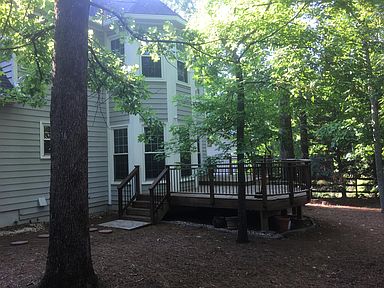
Find the location of `enclosed porch`. enclosed porch is located at coordinates (160, 192), (127, 190), (189, 184), (226, 186), (280, 186), (302, 176), (224, 165).